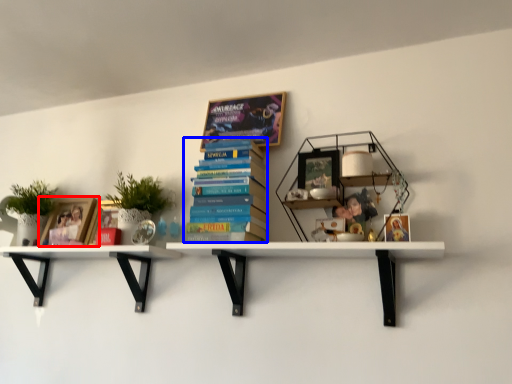
Question: Which object is closer to the camera taking this photo, book cover (highlighted by a red box) or book (highlighted by a blue box)?

Choices:
 (A) book cover
 (B) book

Answer: (B)